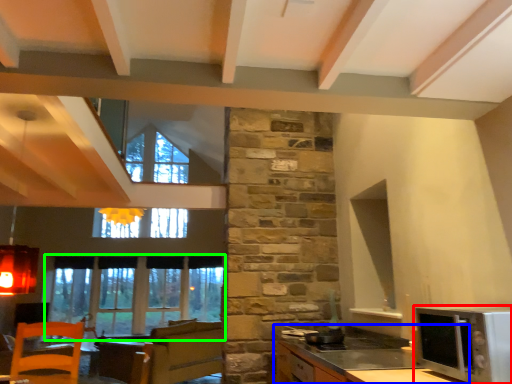
Question: Based on their relative distances, which object is farther from microwave oven (highlighted by a red box)? Choose from cabinetry (highlighted by a blue box) and window (highlighted by a green box).

Choices:
 (A) cabinetry
 (B) window

Answer: (B)